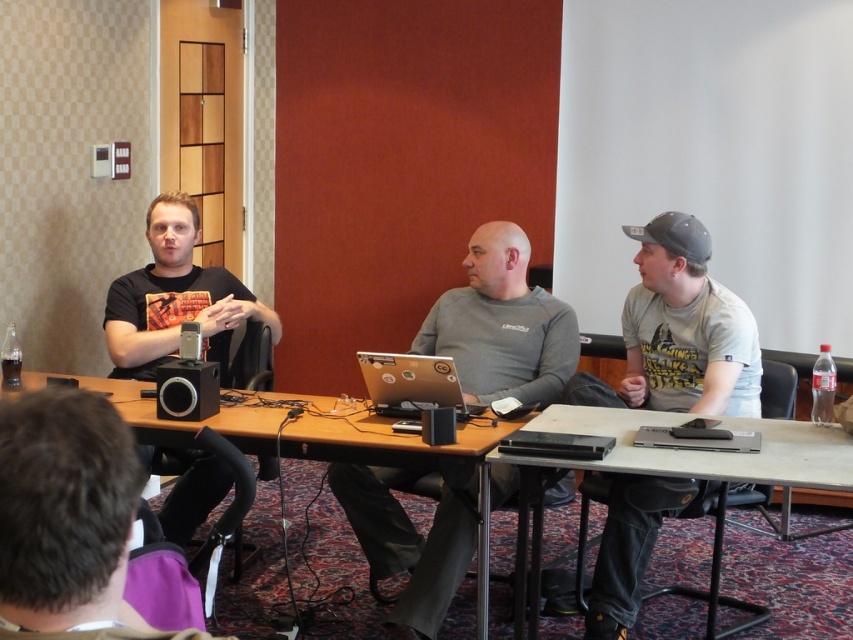
Question: Which point appears closest to the camera in this image?

Choices:
 (A) (747, 384)
 (B) (828, 484)

Answer: (B)

Question: Observing the image, what is the correct spatial positioning of black plastic table at center in reference to silver metallic laptop at center?

Choices:
 (A) right
 (B) left

Answer: (A)

Question: Can you confirm if black matte t-shirt at left is positioned to the left of black plastic table at center?

Choices:
 (A) no
 (B) yes

Answer: (B)

Question: Which point is closer to the camera taking this photo?

Choices:
 (A) (129, 340)
 (B) (749, 410)

Answer: (B)

Question: In this image, where is gray cotton t-shirt at right located relative to satin silver laptop at center?

Choices:
 (A) right
 (B) left

Answer: (A)

Question: Which of the following is the farthest from the observer?

Choices:
 (A) silver metallic laptop at center
 (B) black matte t-shirt at left
 (C) gray cotton t-shirt at right
 (D) black plastic table at center

Answer: (B)